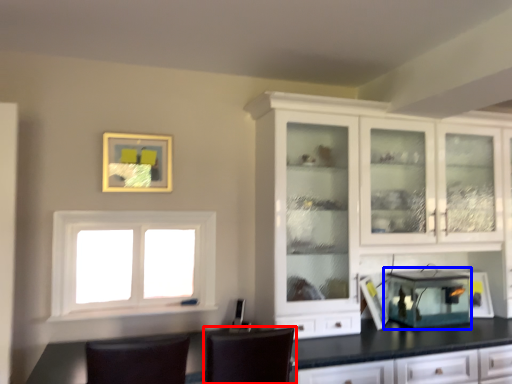
Question: Which of the following is the closest to the observer, chair (highlighted by a red box) or appliance (highlighted by a blue box)?

Choices:
 (A) chair
 (B) appliance

Answer: (A)